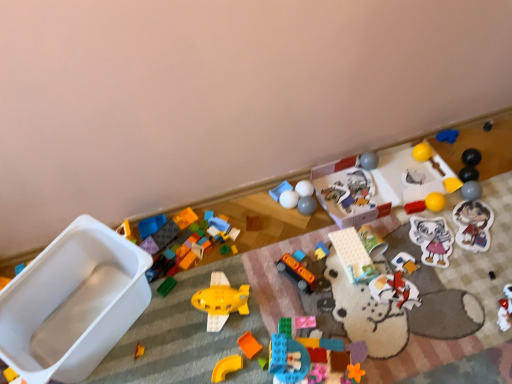
Identify the location of free space that is in between yellow matte square at center-right, placed as the 22th toy when sorted from left to right, and orange matte bus at center, the tenth toy when ordered from left to right. (386, 237).